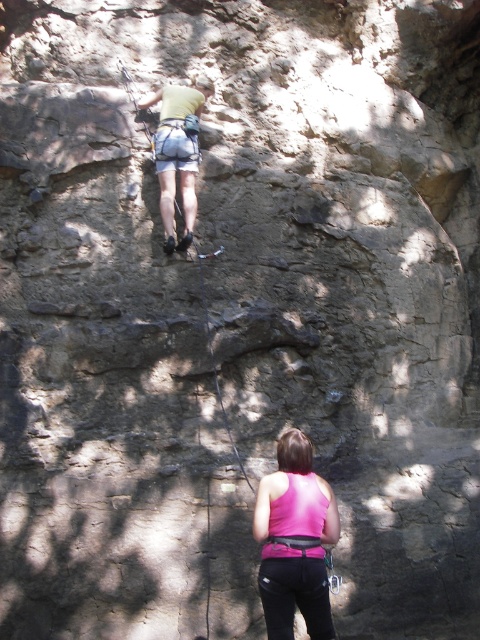
Question: Can you confirm if pink fabric tank top at lower center is positioned to the left of matte yellow shirt at upper center?

Choices:
 (A) no
 (B) yes

Answer: (A)

Question: Which of the following is the closest to the observer?

Choices:
 (A) pink fabric tank top at lower center
 (B) matte yellow shirt at upper center
 (C) black nylon rope at center

Answer: (A)

Question: Is pink fabric tank top at lower center wider than matte yellow shirt at upper center?

Choices:
 (A) yes
 (B) no

Answer: (B)

Question: Is pink fabric tank top at lower center wider than black nylon rope at center?

Choices:
 (A) no
 (B) yes

Answer: (B)

Question: Which object appears closest to the camera in this image?

Choices:
 (A) black nylon rope at center
 (B) matte yellow shirt at upper center
 (C) pink fabric tank top at lower center

Answer: (C)

Question: Which point is closer to the camera?

Choices:
 (A) matte yellow shirt at upper center
 (B) pink fabric tank top at lower center
 (C) black nylon rope at center

Answer: (B)